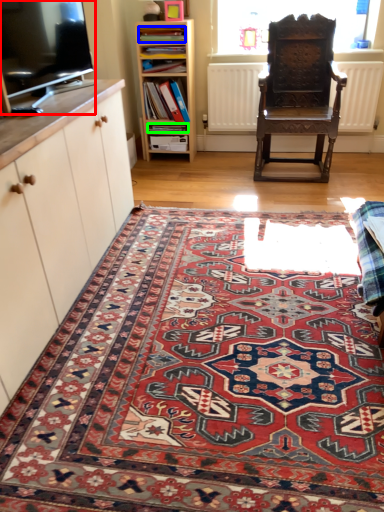
Question: Which is nearer to the television (highlighted by a red box)? book (highlighted by a blue box) or book (highlighted by a green box).

Choices:
 (A) book
 (B) book

Answer: (A)